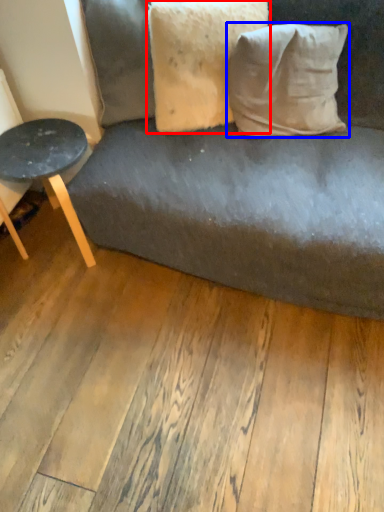
Question: Which object appears closest to the camera in this image, pillow (highlighted by a red box) or pillow (highlighted by a blue box)?

Choices:
 (A) pillow
 (B) pillow

Answer: (A)